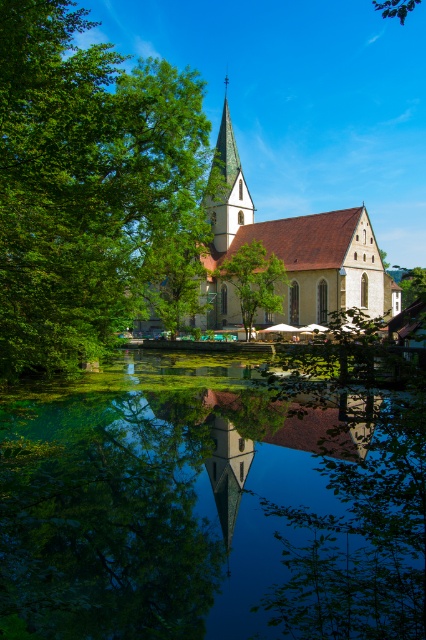
Question: Which point appears farthest from the camera in this image?

Choices:
 (A) (250, 452)
 (B) (207, 212)
 (C) (256, 257)

Answer: (B)

Question: In this image, where is light brown stone church at center located relative to green stone tower at center?

Choices:
 (A) below
 (B) above

Answer: (A)

Question: Which of these objects is positioned closest to the light brown stone church at center?

Choices:
 (A) green stone tower at center
 (B) green reflective water at center
 (C) green leafy tree at left
 (D) green leafy tree at upper center

Answer: (A)

Question: Is light brown stone church at center bigger than green leafy tree at upper center?

Choices:
 (A) yes
 (B) no

Answer: (A)

Question: Is green leafy tree at left above green leafy tree at center?

Choices:
 (A) no
 (B) yes

Answer: (B)

Question: Which of the following is the farthest from the observer?

Choices:
 (A) green stone tower at center
 (B) light brown stone church at center
 (C) green leafy tree at center
 (D) green leafy tree at left

Answer: (A)